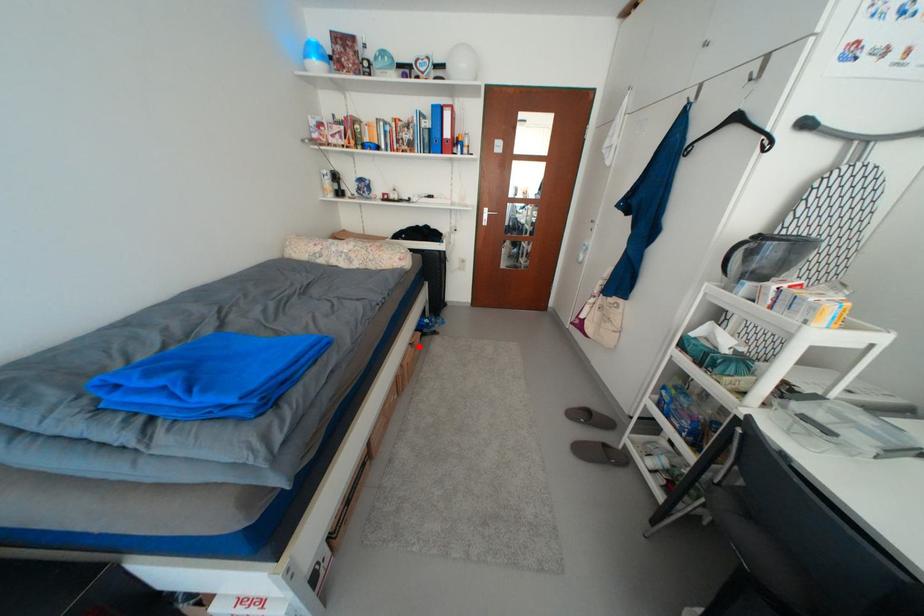
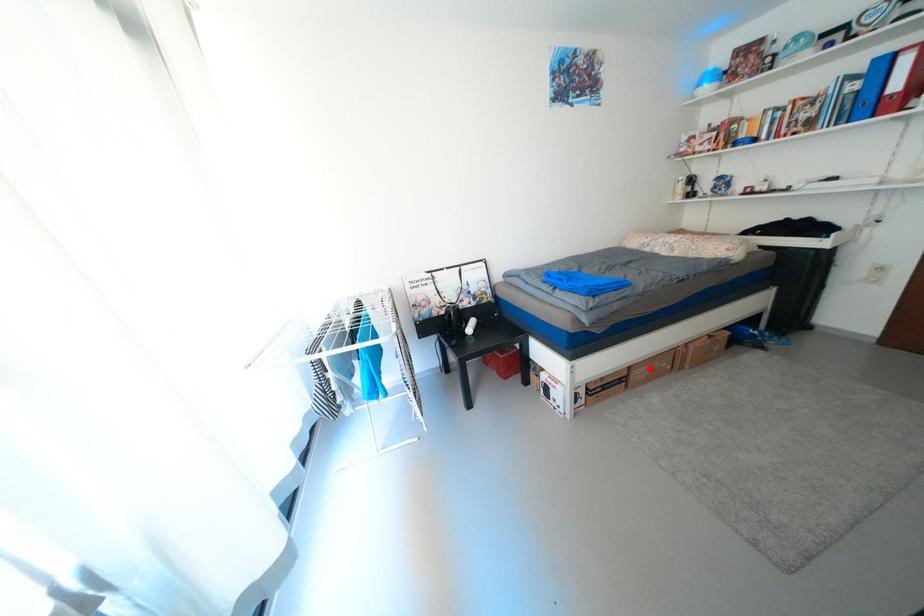
I am providing you with two images of the same scene from different viewpoints. A red point is marked on the first image and another point is marked on the second image. Does the point marked in image1 correspond to the same location as the one in image2?

No